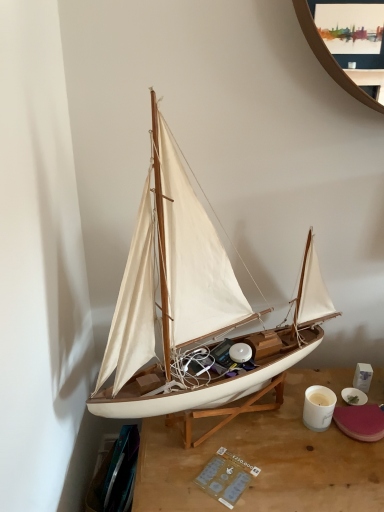
Question: Does point (377, 490) appear closer or farther from the camera than point (324, 389)?

Choices:
 (A) closer
 (B) farther

Answer: (A)

Question: From the image's perspective, is wooden desk at center above or below white glossy coffee cup at lower right?

Choices:
 (A) above
 (B) below

Answer: (B)

Question: Estimate the real-world distances between objects in this image. Which object is farther from the white matte sailboat at center?

Choices:
 (A) wooden desk at center
 (B) white glossy coffee cup at lower right

Answer: (B)

Question: Estimate the real-world distances between objects in this image. Which object is closer to the wooden desk at center?

Choices:
 (A) white matte sailboat at center
 (B) white glossy coffee cup at lower right

Answer: (B)